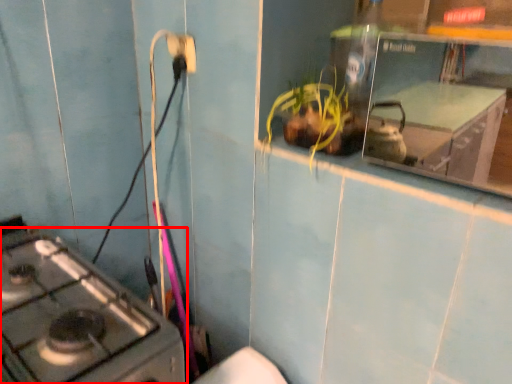
Question: Where is gas stove (annotated by the red box) located in relation to electric outlet in the image?

Choices:
 (A) left
 (B) right

Answer: (A)